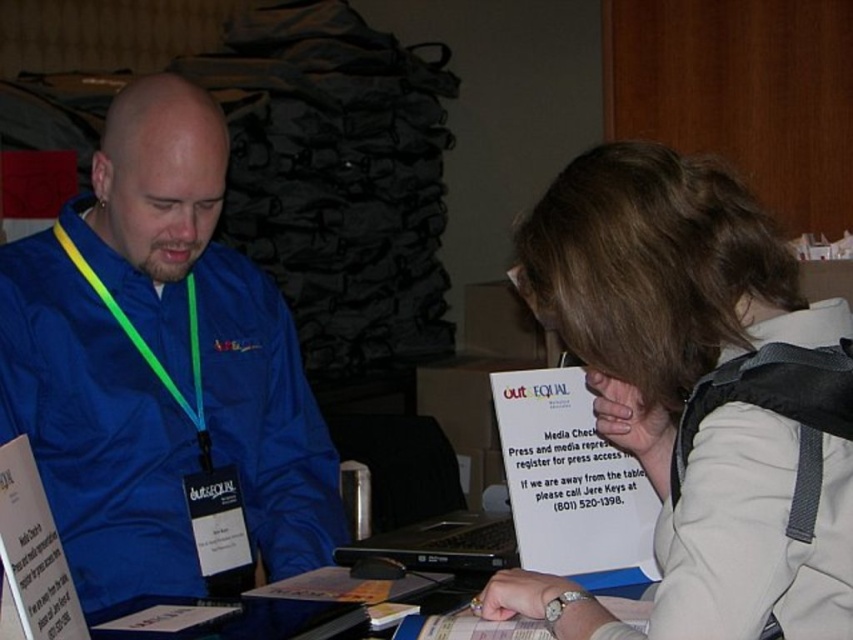
Question: Does blue fabric jacket at left appear under green/yellow fabric lanyard at left?

Choices:
 (A) yes
 (B) no

Answer: (A)

Question: Does light beige fabric jacket at lower right have a lesser width compared to green/yellow fabric lanyard at left?

Choices:
 (A) no
 (B) yes

Answer: (A)

Question: Is black plastic laptop at center to the left of green/yellow fabric lanyard at left from the viewer's perspective?

Choices:
 (A) yes
 (B) no

Answer: (B)

Question: Considering the real-world distances, which object is closest to the green/yellow fabric lanyard at left?

Choices:
 (A) light beige fabric jacket at lower right
 (B) blue fabric jacket at left

Answer: (B)

Question: Estimate the real-world distances between objects in this image. Which object is closer to the blue fabric jacket at left?

Choices:
 (A) black plastic laptop at center
 (B) light beige fabric jacket at lower right

Answer: (A)

Question: Which of these objects is positioned farthest from the green/yellow fabric lanyard at left?

Choices:
 (A) black plastic laptop at center
 (B) blue fabric jacket at left
 (C) light beige fabric jacket at lower right

Answer: (C)